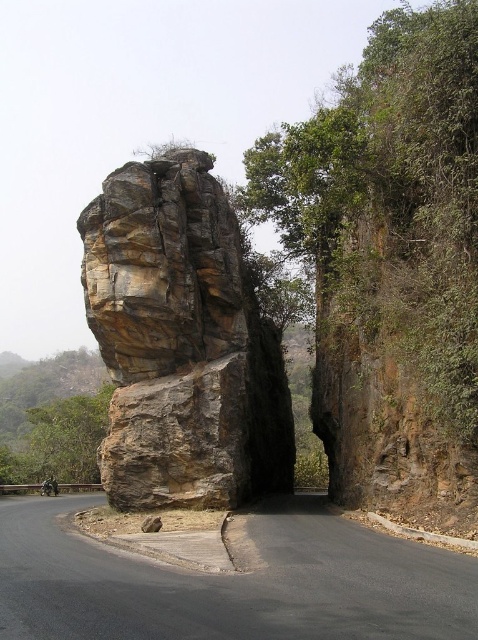
You are a hiker who wants to take a photo of the rustic stone rock at center and the green leafy tree at left together in the same frame. Your camera has a maximum zoom range that can capture objects up to 50 meters apart. Can you fit both objects in one photo without moving your position?

The rustic stone rock at center and green leafy tree at left are 51.72 meters apart. Since the camera can only capture up to 50 meters, you cannot fit both objects in one photo without moving your position.

You are a hiker standing on the asphalt road at center. You want to climb onto the rustic stone rock at center. Is the rock higher than the road surface you are standing on?

The rustic stone rock at center has a greater height compared to asphalt road at center, so yes, the rock is higher than the road surface you are standing on.

You are a hiker planning to take a photo of the asphalt road at center and the green leafy tree at left from a distance. Which object will appear smaller in the photo?

The asphalt road at center will appear smaller in the photo because it is shorter than the green leafy tree at left.